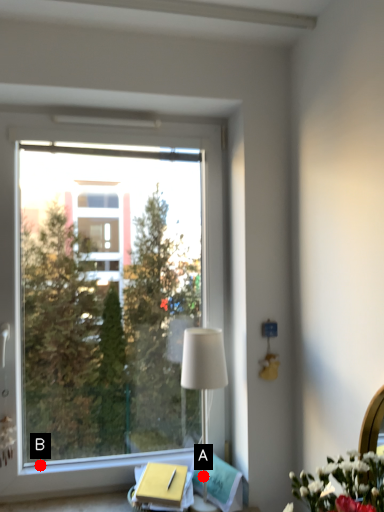
Question: Two points are circled on the image, labeled by A and B beside each circle. Which of the following is the closest to the observer?

Choices:
 (A) A is closer
 (B) B is closer

Answer: (A)